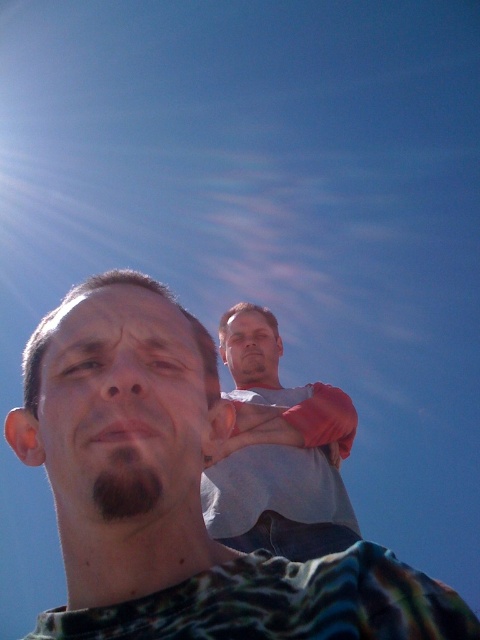
Is the position of matte skin head at center less distant than that of smooth skin head at upper center?

Yes, matte skin head at center is in front of smooth skin head at upper center.

Between point (64, 305) and point (253, 314), which one is positioned in front?

Point (64, 305)

At what (x,y) coordinates should I click in order to perform the action: click on matte skin head at center. Please return your answer as a coordinate pair (x, y). Looking at the image, I should click on (90, 292).

Between point (272, 396) and point (240, 326), which one is positioned in front?

Point (272, 396) is more forward.

How far apart are gray cotton shirt at center and smooth skin head at upper center?

A distance of 10.63 inches exists between gray cotton shirt at center and smooth skin head at upper center.

Identify the location of gray cotton shirt at center. Image resolution: width=480 pixels, height=640 pixels. pyautogui.click(x=278, y=451).

Locate an element on the screen. gray cotton shirt at center is located at coordinates (278, 451).

Between camouflage shirt at center and matte skin head at center, which one appears on the right side from the viewer's perspective?

From the viewer's perspective, camouflage shirt at center appears more on the right side.

Is camouflage shirt at center taller than matte skin head at center?

Yes, camouflage shirt at center is taller than matte skin head at center.

Describe the element at coordinates (178, 492) in the screenshot. I see `camouflage shirt at center` at that location.

Locate an element on the screen. The width and height of the screenshot is (480, 640). camouflage shirt at center is located at coordinates (178, 492).